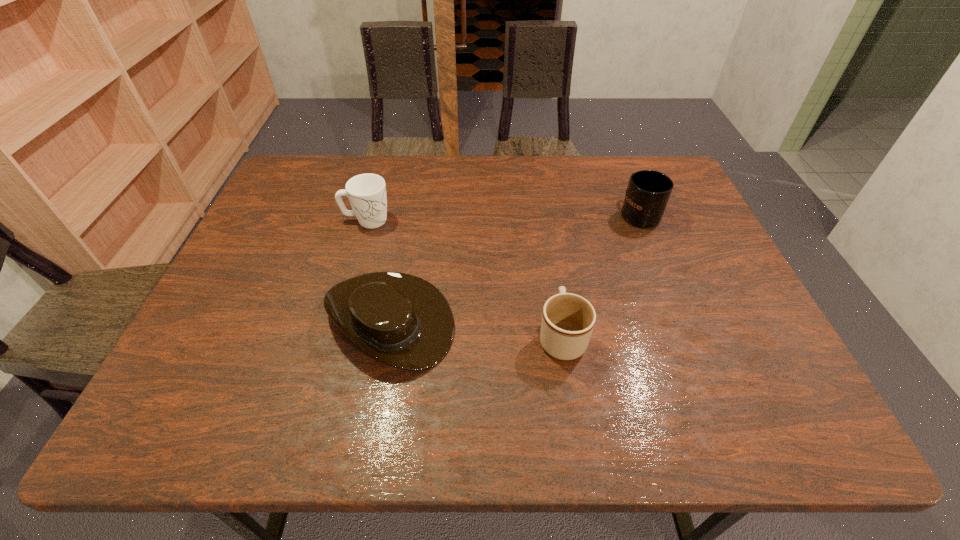
I want to click on free point between the cowboy hat and the second mug from left to right, so click(x=475, y=328).

Locate an element on the screen. This screenshot has height=540, width=960. vacant region between the leftmost mug and the nearest mug is located at coordinates (465, 279).

Locate an element on the screen. The image size is (960, 540). free spot between the leftmost mug and the second mug from right to left is located at coordinates (465, 279).

Select which object is the third closest to the rightmost mug. Please provide its 2D coordinates. Your answer should be formatted as a tuple, i.e. [(x, y)], where the tuple contains the x and y coordinates of a point satisfying the conditions above.

[(367, 194)]

Locate an element on the screen. the second closest object relative to the second mug from right to left is located at coordinates coord(648,192).

This screenshot has width=960, height=540. What are the coordinates of `mug that is the closest one to the shortest object` in the screenshot? It's located at pyautogui.click(x=367, y=194).

Point out which mug is positioned as the second nearest to the rightmost object. Please provide its 2D coordinates. Your answer should be formatted as a tuple, i.e. [(x, y)], where the tuple contains the x and y coordinates of a point satisfying the conditions above.

[(367, 194)]

Identify the location of vacant position in the image that satisfies the following two spatial constraints: 1. on the side of the shortest object with the handle; 2. on the right side of the leftmost mug. Image resolution: width=960 pixels, height=540 pixels. (338, 320).

This screenshot has width=960, height=540. What are the coordinates of `vacant space that satisfies the following two spatial constraints: 1. on the side of the nearest mug with the handle; 2. on the side of the leftmost mug with the handle` in the screenshot? It's located at (543, 220).

The height and width of the screenshot is (540, 960). I want to click on vacant region that satisfies the following two spatial constraints: 1. on the side of the leftmost mug with the handle; 2. on the back side of the cowboy hat, so coord(338,320).